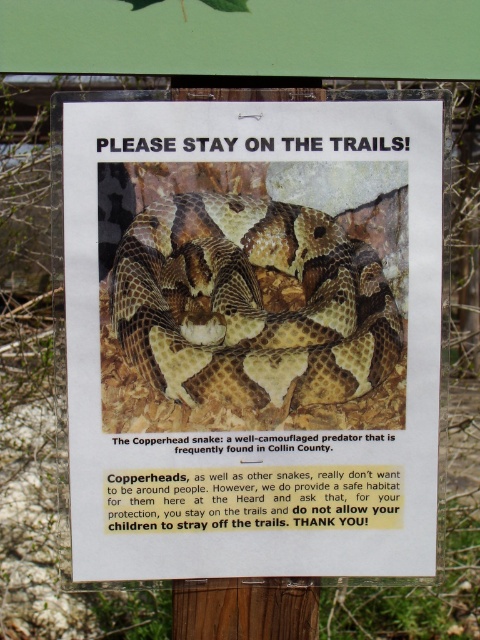
You are standing in front of the signboard and want to touch the point at coordinates point (180, 323). Can you reach it without moving your body?

The distance of point (180, 323) from viewer is 1.19 meters. Since the average arm length is about 0.7 meters, you cannot reach the point without moving your body.